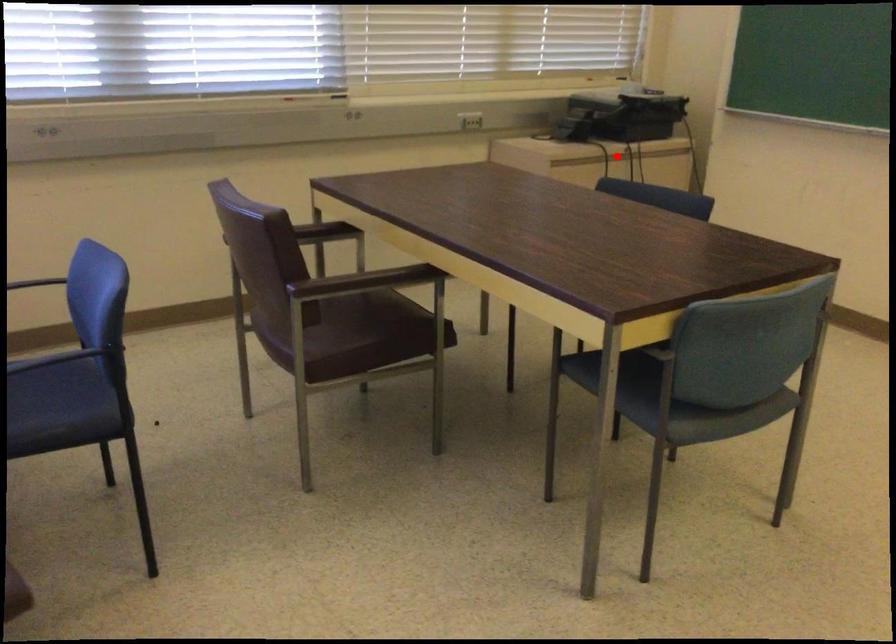
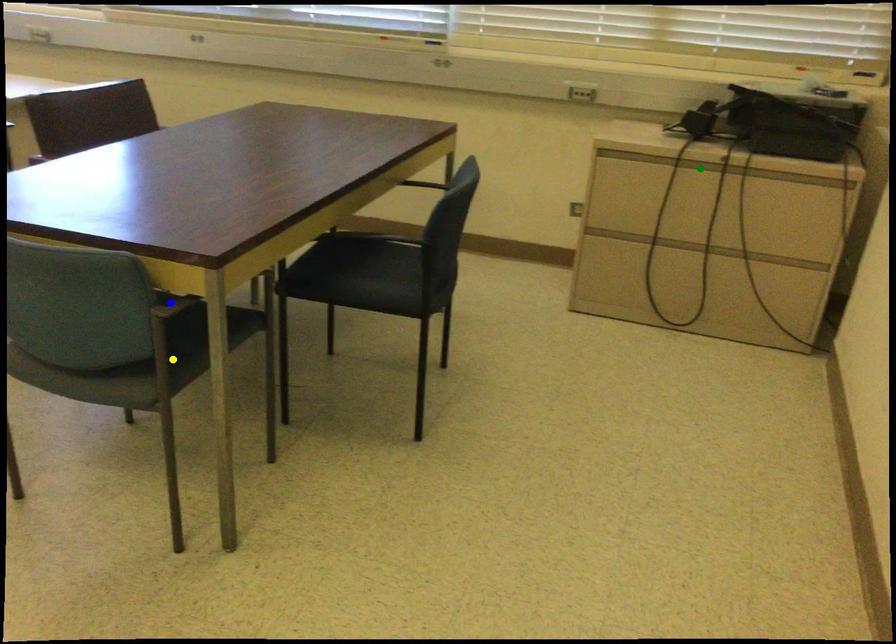
Question: I am providing you with two images of the same scene from different viewpoints. A red point is marked on the first image. You are given multiple points on the second image. Which mark in image 2 goes with the point in image 1?

Choices:
 (A) green point
 (B) yellow point
 (C) blue point

Answer: (A)